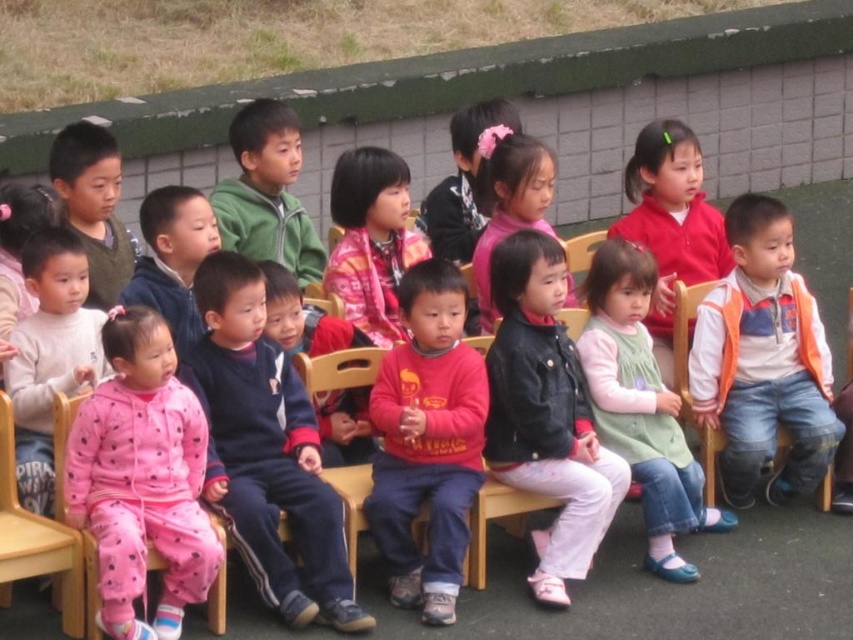
Between dark blue fleece jacket at center and plaid fabric shirt at center, which one appears on the left side from the viewer's perspective?

dark blue fleece jacket at center

Measure the distance from dark blue fleece jacket at center to plaid fabric shirt at center.

They are 6.09 feet apart.

From the picture: Who is more forward, (248, 536) or (358, 164)?

Positioned in front is point (248, 536).

Locate an element on the screen. dark blue fleece jacket at center is located at coordinates (265, 451).

Which is more to the left, pink fleece pajamas at lower left or green dress at center?

pink fleece pajamas at lower left is more to the left.

Is pink fleece pajamas at lower left below green dress at center?

Yes, pink fleece pajamas at lower left is below green dress at center.

Between point (138, 369) and point (663, 541), which one is positioned behind?

Point (663, 541)

Image resolution: width=853 pixels, height=640 pixels. I want to click on pink fleece pajamas at lower left, so click(141, 477).

Is green dress at center closer to the viewer compared to plaid fabric shirt at center?

That is True.

Does green dress at center appear over plaid fabric shirt at center?

No, green dress at center is not above plaid fabric shirt at center.

Which is behind, point (711, 518) or point (403, 268)?

The point (403, 268) is more distant.

Find the location of a particular element. This screenshot has width=853, height=640. green dress at center is located at coordinates (641, 404).